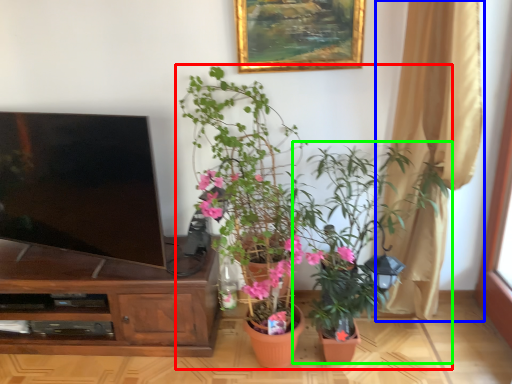
Question: Considering the real-world distances, which object is closest to houseplant (highlighted by a red box)? curtain (highlighted by a blue box) or houseplant (highlighted by a green box).

Choices:
 (A) curtain
 (B) houseplant

Answer: (B)